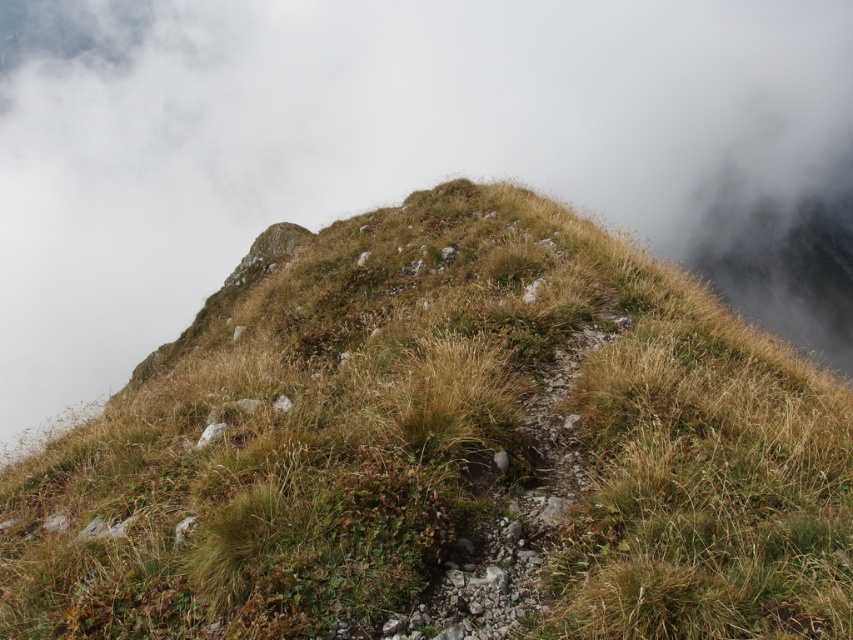
You are standing on the rugged grassy hillside and want to reach the two points mentioned. Which point is closer to you, point(x=786, y=372) or point(x=724, y=296)?

A: Point(x=786, y=372) is closer to the viewer than point(x=724, y=296).

You are standing at the base of the hillside and want to reach the point marked at coordinates point (579, 502). Given that the path is narrow and rocky, do you think you can safely walk to that point without needing to climb?

The point marked at coordinates point (579, 502) is 18.26 feet away from the camera, so yes, you can safely walk to that point along the narrow rocky path without needing to climb since it is within a manageable distance and the path exists.

You are a hiker standing on the rugged, grassy hillside. You notice the green grassy at center and the white fluffy cloud at upper center. Which object is nearer to you?

The green grassy at center is closer to the viewer than the white fluffy cloud at upper center.